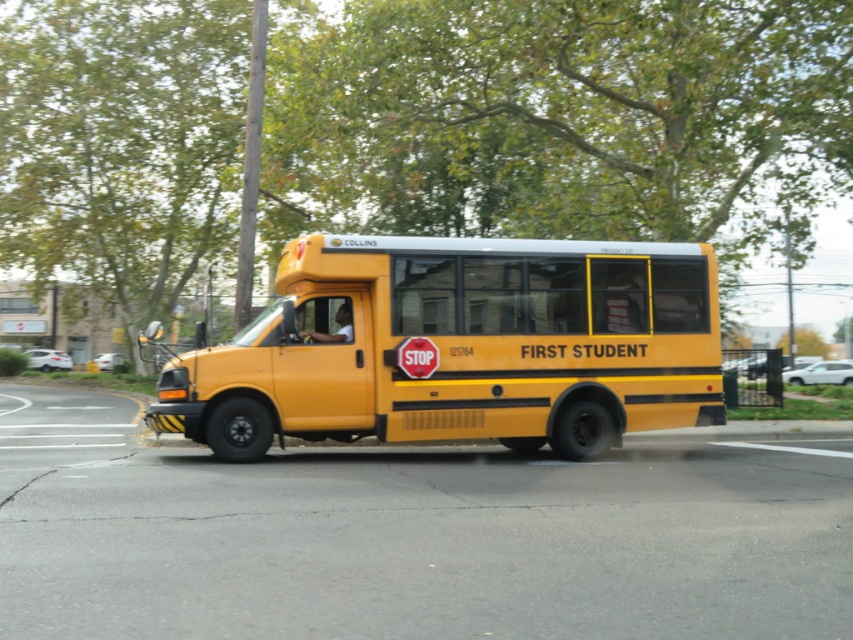
In the scene shown: You are a traffic officer assessing the scene. You notice the yellow matte bus at center and the red matte stop sign at center. Which object is larger in size?

The yellow matte bus at center is bigger than the red matte stop sign at center.